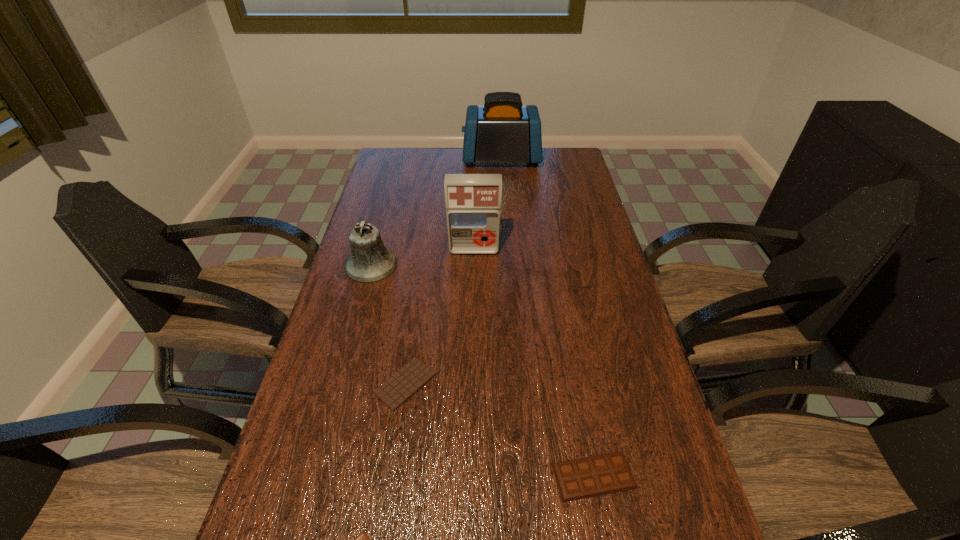
This screenshot has width=960, height=540. Find the location of `object that stands as the fifth closest to the second shortest chocolate bar`. object that stands as the fifth closest to the second shortest chocolate bar is located at coordinates [x=503, y=130].

Identify the location of chocolate bar that is the nearest to the toaster. Image resolution: width=960 pixels, height=540 pixels. (394, 392).

Choose which chocolate bar is the third nearest neighbor to the third tallest object. Please provide its 2D coordinates. Your answer should be formatted as a tuple, i.e. [(x, y)], where the tuple contains the x and y coordinates of a point satisfying the conditions above.

[(362, 539)]

The height and width of the screenshot is (540, 960). I want to click on vacant point that satisfies the following two spatial constraints: 1. on the front-facing side of the rightmost chocolate bar; 2. on the right side of the toaster, so click(x=524, y=476).

Image resolution: width=960 pixels, height=540 pixels. I want to click on free space that satisfies the following two spatial constraints: 1. on the front-facing side of the toaster; 2. on the front-facing side of the first-aid kit, so click(508, 250).

Find the location of `vacant point that satisfies the following two spatial constraints: 1. on the front-facing side of the farthest object; 2. on the front side of the bell`. vacant point that satisfies the following two spatial constraints: 1. on the front-facing side of the farthest object; 2. on the front side of the bell is located at coordinates (509, 265).

Find the location of `free location that satisfies the following two spatial constraints: 1. on the front-facing side of the farthest object; 2. on the right side of the second nearest object`. free location that satisfies the following two spatial constraints: 1. on the front-facing side of the farthest object; 2. on the right side of the second nearest object is located at coordinates (524, 476).